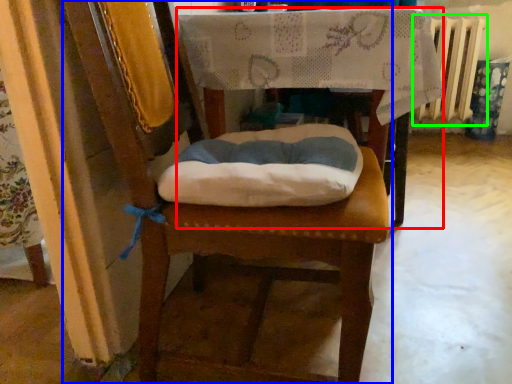
Question: Based on their relative distances, which object is farther from table (highlighted by a red box)? Choose from chair (highlighted by a blue box) and radiator (highlighted by a green box).

Choices:
 (A) chair
 (B) radiator

Answer: (B)